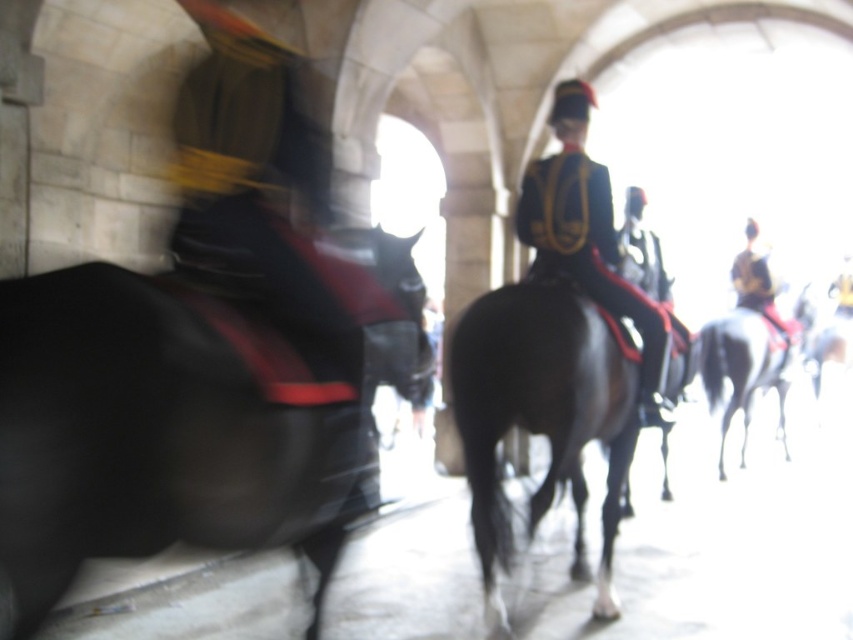
Question: Is black glossy horse at left bigger than shiny gold helmet at right?

Choices:
 (A) no
 (B) yes

Answer: (B)

Question: Does white glossy horse at center lie behind shiny gold helmet at right?

Choices:
 (A) no
 (B) yes

Answer: (B)

Question: Is black glossy horse at left to the right of shiny gold epaulets at center from the viewer's perspective?

Choices:
 (A) yes
 (B) no

Answer: (B)

Question: Which point is farther to the camera?

Choices:
 (A) shiny gold epaulets at center
 (B) black glossy horse at left

Answer: (A)

Question: Which of the following is the closest to the observer?

Choices:
 (A) (750, 364)
 (B) (164, 467)
 (C) (767, 300)
 (D) (654, 333)

Answer: (B)

Question: Estimate the real-world distances between objects in this image. Which object is farther from the white glossy horse at center?

Choices:
 (A) shiny black horse at center
 (B) white glossy horse at right

Answer: (A)